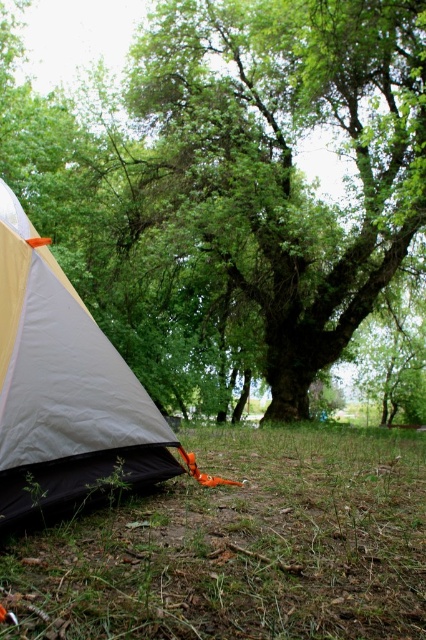
You are setting up a tent in the camping scene and need to ensure it doesn not block the view of the green leafy tree at center. Where should you place the tent to keep the tree visible?

The green leafy tree at center is located at point (282, 157), so placing the tent away from this coordinate will ensure the tree remains visible.